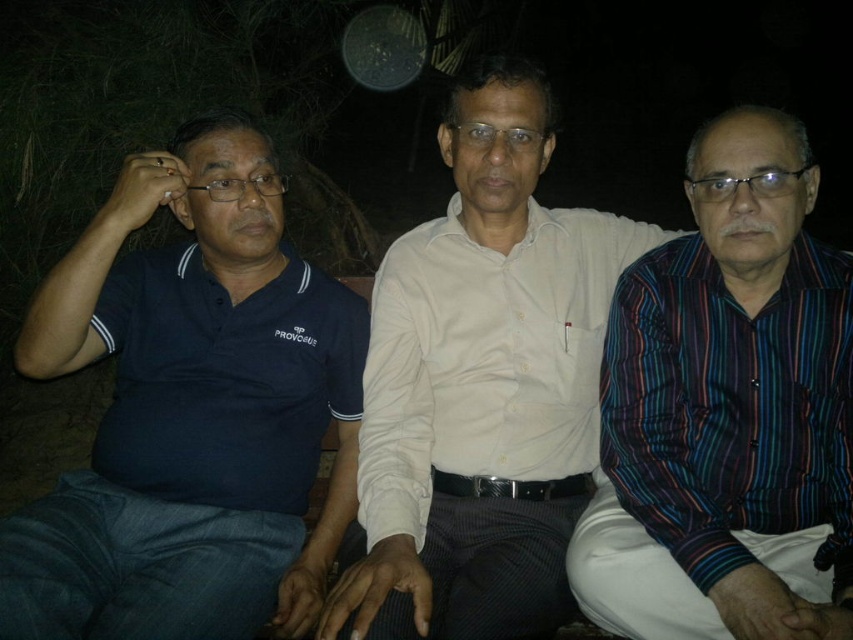
Can you confirm if dark blue polo shirt at left is bigger than striped cotton shirt at right?

Correct, dark blue polo shirt at left is larger in size than striped cotton shirt at right.

Locate an element on the screen. The image size is (853, 640). dark blue polo shirt at left is located at coordinates tap(190, 412).

Can you confirm if striped cotton shirt at right is positioned to the left of dark blue cotton polo shirt at left?

In fact, striped cotton shirt at right is to the right of dark blue cotton polo shirt at left.

Who is positioned more to the left, striped cotton shirt at right or dark blue cotton polo shirt at left?

dark blue cotton polo shirt at left is more to the left.

Identify the location of striped cotton shirt at right. (727, 412).

I want to click on striped cotton shirt at right, so click(x=727, y=412).

Is point (117, 285) in front of point (416, 266)?

No.

Does dark blue polo shirt at left appear over white cotton shirt at center?

Actually, dark blue polo shirt at left is below white cotton shirt at center.

This screenshot has width=853, height=640. Identify the location of dark blue polo shirt at left. (190, 412).

You are a GUI agent. You are given a task and a screenshot of the screen. Output one action in this format:
    pyautogui.click(x=<x>, y=<y>)
    Task: Click on the dark blue polo shirt at left
    The image size is (853, 640).
    Given the screenshot: What is the action you would take?
    pyautogui.click(x=190, y=412)